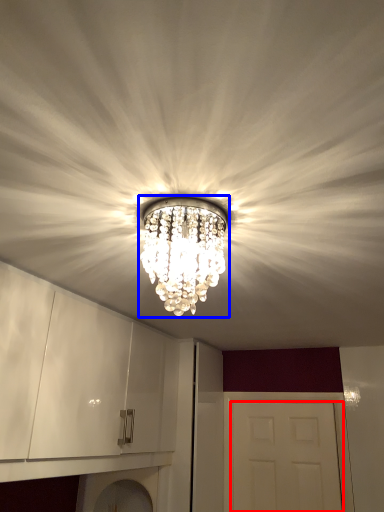
Question: Among these objects, which one is farthest to the camera, door (highlighted by a red box) or lamp (highlighted by a blue box)?

Choices:
 (A) door
 (B) lamp

Answer: (A)